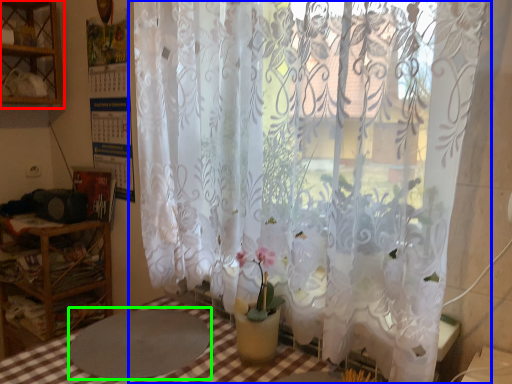
Question: Which object is positioned farthest from shelf (highlighted by a red box)? Select from curtain (highlighted by a blue box) and round table (highlighted by a green box).

Choices:
 (A) curtain
 (B) round table

Answer: (B)